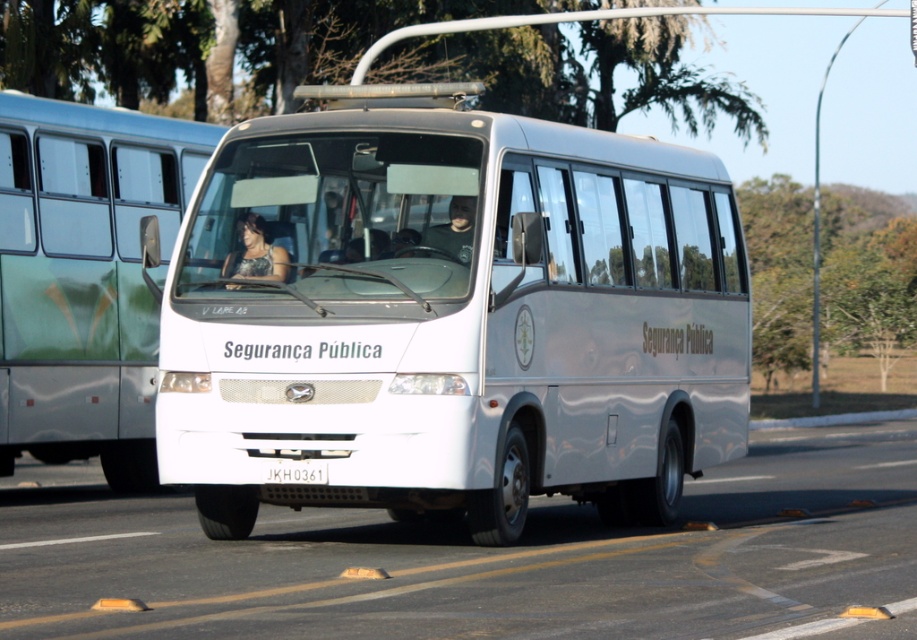
Is white metallic bus at center wider than sparkly silver dress at center?

Indeed, white metallic bus at center has a greater width compared to sparkly silver dress at center.

Which is more to the right, white metallic bus at center or sparkly silver dress at center?

white metallic bus at center

Is point (622, 493) in front of point (251, 257)?

No, (622, 493) is behind (251, 257).

What are the coordinates of `white metallic bus at center` in the screenshot? It's located at (454, 317).

Which is in front, point (43, 156) or point (249, 230)?

Positioned in front is point (249, 230).

Is white glossy bus at center taller than sparkly silver dress at center?

Yes.

Describe the element at coordinates (85, 276) in the screenshot. I see `white glossy bus at center` at that location.

You are a GUI agent. You are given a task and a screenshot of the screen. Output one action in this format:
    pyautogui.click(x=<x>, y=<y>)
    Task: Click on the white glossy bus at center
    The height and width of the screenshot is (640, 917).
    Given the screenshot: What is the action you would take?
    pyautogui.click(x=85, y=276)

Which of these two, white metallic bus at center or matte black jacket at center, stands shorter?

matte black jacket at center is shorter.

Is point (646, 161) in front of point (459, 243)?

No, (646, 161) is behind (459, 243).

Locate an element on the screen. white metallic bus at center is located at coordinates (454, 317).